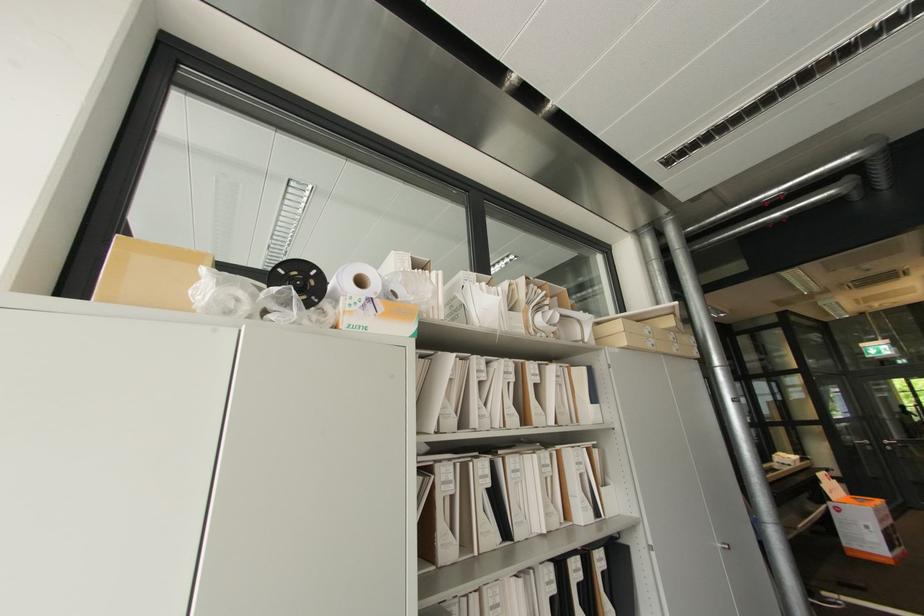
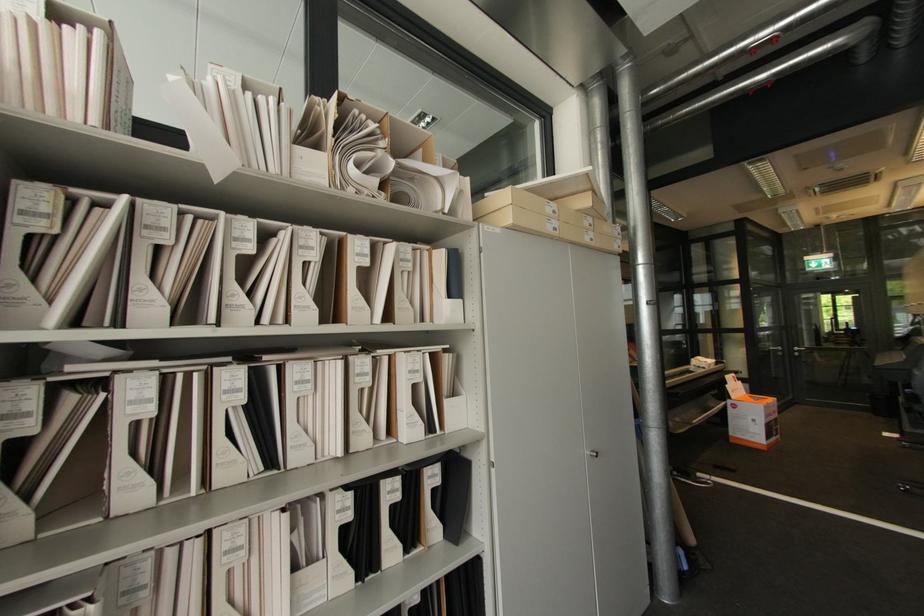
Find the pixel in the second image that matches the point at 727,549 in the first image.

(596, 456)